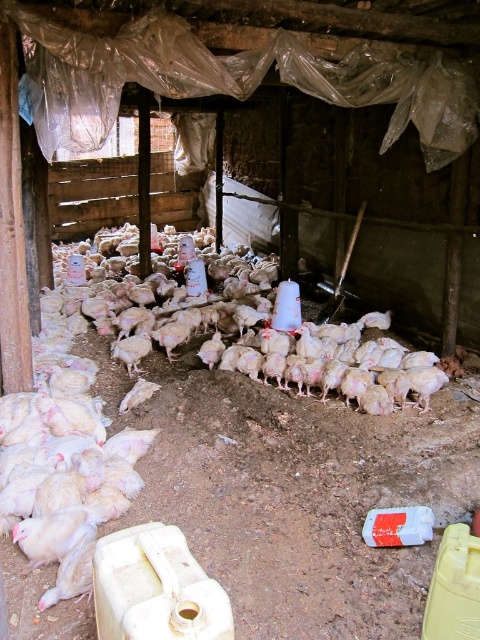
Question: Among these objects, which one is nearest to the camera?

Choices:
 (A) white feathered chicken at center
 (B) white matte chicken at center

Answer: (A)

Question: Can you confirm if white feathered chicken at center is wider than white matte chicken at center?

Choices:
 (A) yes
 (B) no

Answer: (B)

Question: Which point is farther to the camera?

Choices:
 (A) white feathered chicken at center
 (B) white matte chicken at center

Answer: (B)

Question: Can you confirm if white feathered chicken at center is positioned to the right of white matte chicken at center?

Choices:
 (A) yes
 (B) no

Answer: (B)

Question: Does white feathered chicken at center appear over white matte chicken at center?

Choices:
 (A) yes
 (B) no

Answer: (B)